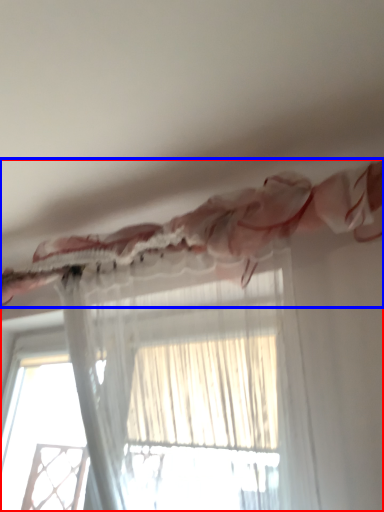
Question: Which object appears farthest to the camera in this image, curtain (highlighted by a red box) or curtain (highlighted by a blue box)?

Choices:
 (A) curtain
 (B) curtain

Answer: (B)